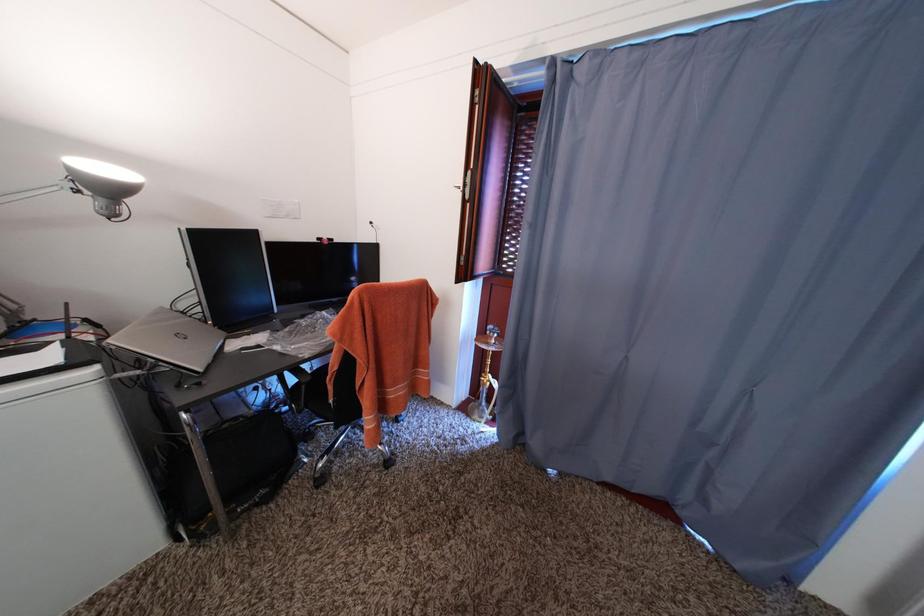
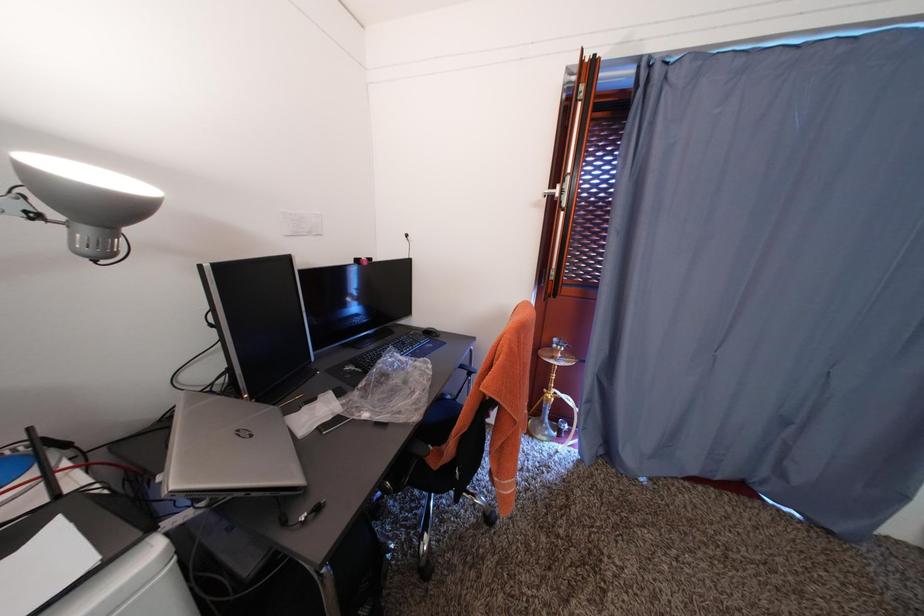
Question: The camera is either moving clockwise (left) or counter-clockwise (right) around the object. The first image is from the beginning of the video and the second image is from the end. Is the camera moving left or right when shooting the video?

Choices:
 (A) Left
 (B) Right

Answer: (A)